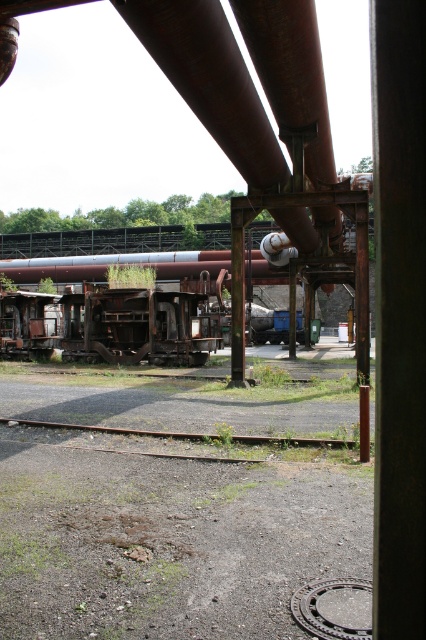
Consider the image. Does rusty metal pole at center have a lesser width compared to rusty metal train track at lower center?

Yes.

Is rusty metal pole at center smaller than rusty metal train track at lower center?

Yes, rusty metal pole at center is smaller than rusty metal train track at lower center.

Where is `rusty metal pole at center`? Image resolution: width=426 pixels, height=640 pixels. rusty metal pole at center is located at coordinates click(399, 316).

Who is lower down, rusty metal pole at center or rusty metal train car at center?

rusty metal pole at center is below.

Find the location of a particular element. rusty metal pole at center is located at coordinates (399, 316).

Is point (394, 80) more distant than point (100, 353)?

No, (394, 80) is closer to viewer.

This screenshot has height=640, width=426. Find the location of `rusty metal pole at center`. rusty metal pole at center is located at coordinates (399, 316).

Can you confirm if rusty metal train car at center is bigger than rusty metal train track at lower center?

Correct, rusty metal train car at center is larger in size than rusty metal train track at lower center.

Which of these two, rusty metal train car at center or rusty metal train track at lower center, stands shorter?

rusty metal train track at lower center

Who is more distant from viewer, (114,314) or (98,428)?

The point (114,314) is more distant.

The image size is (426, 640). Find the location of `rusty metal train car at center`. rusty metal train car at center is located at coordinates (123, 324).